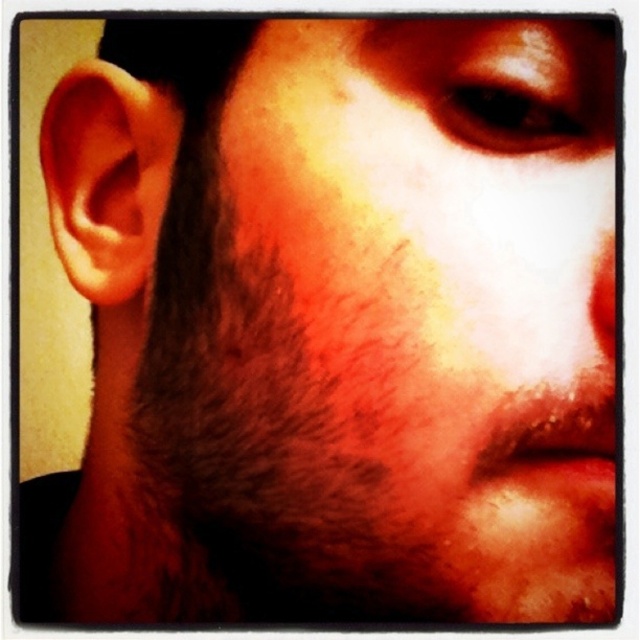
Consider the image. You are a photographer adjusting your camera settings for a close portrait. You notice the dark brown fuzzy beard at left is currently 11.48 inches from the camera lens. If you want to ensure the beard is in focus while keeping the background blurred, should you increase or decrease the aperture size?

To keep the background blurred and ensure the dark brown fuzzy beard at left is in focus, you should decrease the aperture size. A smaller aperture allows for a deeper depth of field, which helps maintain focus on the subject while keeping the background out of focus. However, since the beard is only 11.48 inches from the camera, adjusting the aperture alone may not be sufficient. You might also need to consider the distance between the subject and the background or use a lens with a longer focal length to

You are a photographer adjusting the lighting for a portrait. You notice the dark brown fuzzy beard at left and the brown matte eye at upper center. Which object requires more light to ensure it is properly illuminated given its size?

The dark brown fuzzy beard at left requires more light because it is bigger than the brown matte eye at upper center and needs adequate illumination to match its size.